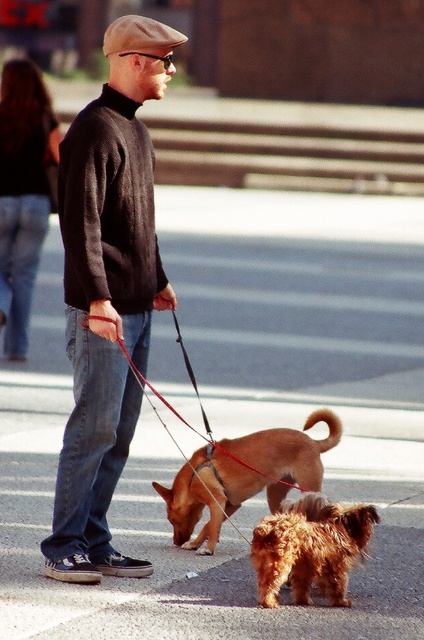
You are a dog walker who needs to determine which dog is taller between the brown furry dog at center and the fuzzy brown dog at lower center. Which one is taller?

The brown furry dog at center is much taller than the fuzzy brown dog at lower center.